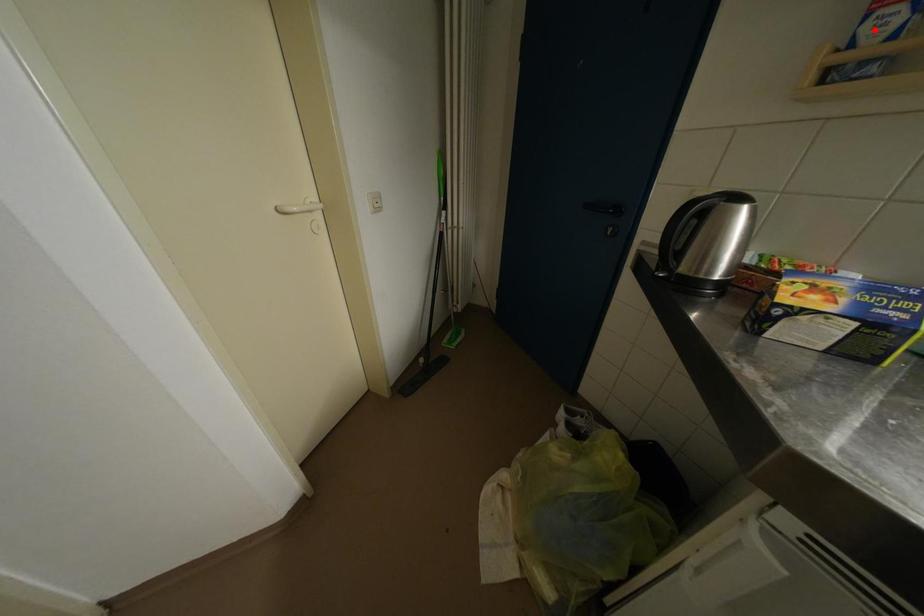
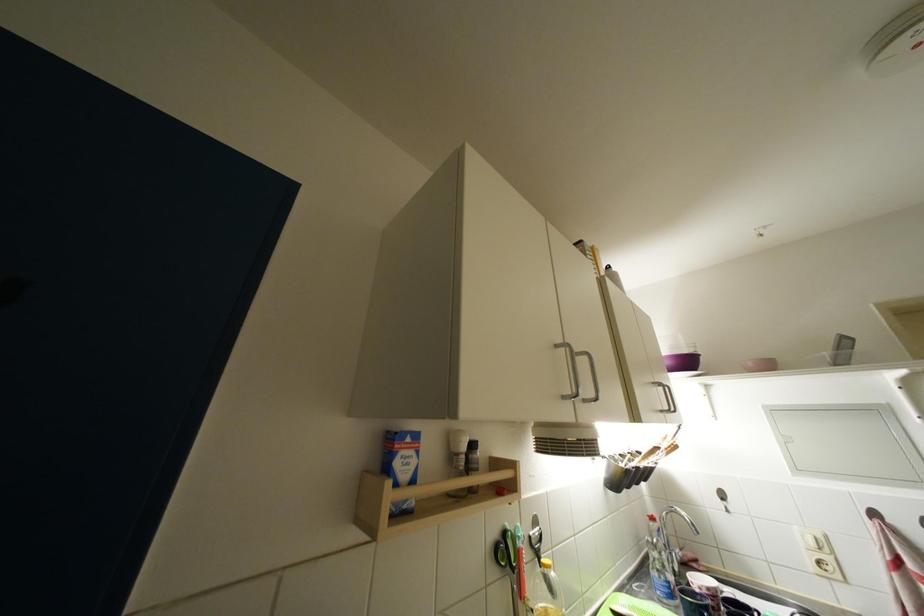
The point at the highlighted location is marked in the first image. Where is the corresponding point in the second image?

(404, 467)